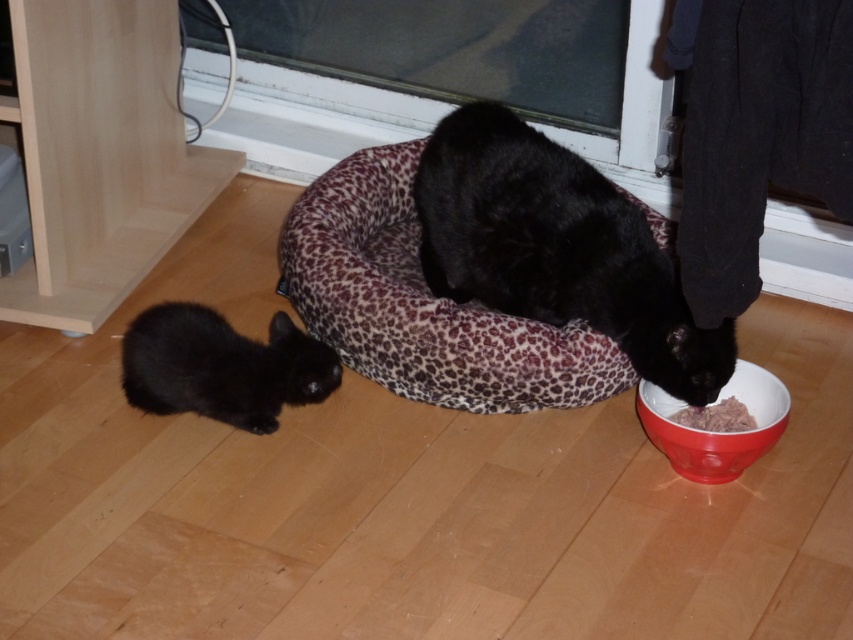
Question: Can you confirm if black fur cat at center is thinner than black fur cat at lower left?

Choices:
 (A) no
 (B) yes

Answer: (A)

Question: Can you confirm if black fur cat at center is positioned below black fur cat at lower left?

Choices:
 (A) no
 (B) yes

Answer: (A)

Question: Can you confirm if black fur cat at center is positioned to the left of black fur cat at lower left?

Choices:
 (A) yes
 (B) no

Answer: (B)

Question: Among these points, which one is nearest to the camera?

Choices:
 (A) (538, 282)
 (B) (674, 438)

Answer: (B)

Question: Which object appears closest to the camera in this image?

Choices:
 (A) black fur cat at center
 (B) black fur cat at lower left

Answer: (A)

Question: Considering the real-world distances, which object is farthest from the red glossy bowl at lower right?

Choices:
 (A) smooth pinkish food at lower center
 (B) black fur cat at lower left
 (C) black fur cat at center

Answer: (B)